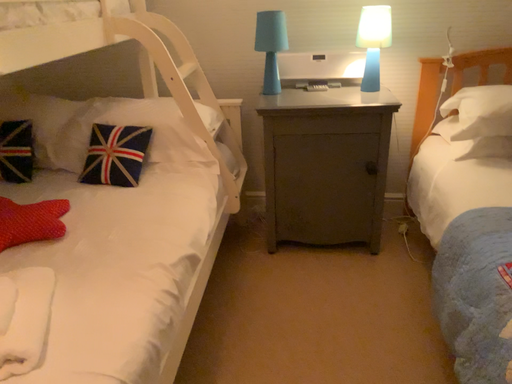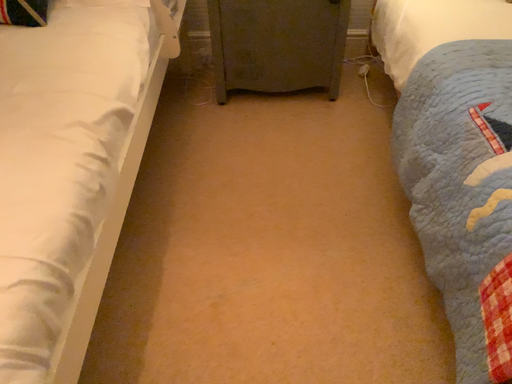
Question: Which way did the camera rotate in the video?

Choices:
 (A) rotated upward
 (B) rotated downward

Answer: (B)